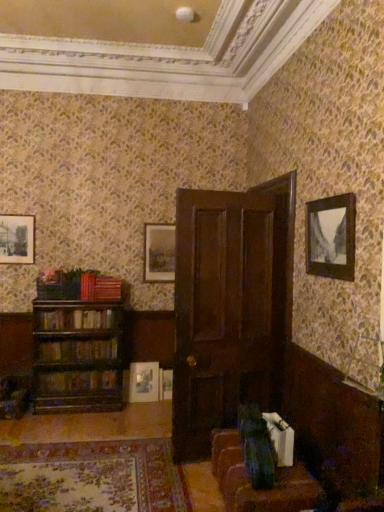
This screenshot has height=512, width=384. Find the location of `dark wood door at center`. dark wood door at center is located at coordinates (230, 307).

At what (x,y) coordinates should I click in order to perform the action: click on matte silver picture frame at center, the 3th picture frame positioned from the right. Please return your answer as a coordinate pair (x, y). Looking at the image, I should click on (144, 382).

From a real-world perspective, is wooden book at left, which is the fourth book from top to bottom, on matte wooden picture frame at center, the second picture frame positioned from the bottom?

Actually, wooden book at left, which is the fourth book from top to bottom, is physically below matte wooden picture frame at center, the second picture frame positioned from the bottom, in the real world.

The image size is (384, 512). Find the location of `book that is the 4th one when counting downward from the matte wooden picture frame at center, which is the first picture frame in back-to-front order (from the image's perspective)`. book that is the 4th one when counting downward from the matte wooden picture frame at center, which is the first picture frame in back-to-front order (from the image's perspective) is located at coordinates (77, 381).

Is point (118, 384) closer to viewer compared to point (165, 233)?

Yes, it is in front of point (165, 233).

Considering the relative sizes of wooden book at left, arranged as the 1th book when ordered from the bottom, and matte wooden picture frame at center, the second picture frame positioned from the bottom, in the image provided, is wooden book at left, arranged as the 1th book when ordered from the bottom, wider than matte wooden picture frame at center, the second picture frame positioned from the bottom,?

Correct, the width of wooden book at left, arranged as the 1th book when ordered from the bottom, exceeds that of matte wooden picture frame at center, the second picture frame positioned from the bottom.

What's the angular difference between matte wooden picture frame at center, which is the fourth picture frame from front to back, and dark wood door at center's facing directions?

There is a 167-degree angle between the facing directions of matte wooden picture frame at center, which is the fourth picture frame from front to back, and dark wood door at center.

Is dark wood door at center at the back of matte wooden picture frame at center, placed as the 2th picture frame when sorted from right to left?

That's not correct — matte wooden picture frame at center, placed as the 2th picture frame when sorted from right to left, is not looking away from dark wood door at center.

Considering the relative positions of matte wooden picture frame at center, the second picture frame positioned from the bottom, and dark wood door at center in the image provided, is matte wooden picture frame at center, the second picture frame positioned from the bottom, to the right of dark wood door at center from the viewer's perspective?

Incorrect, matte wooden picture frame at center, the second picture frame positioned from the bottom, is not on the right side of dark wood door at center.

Who is smaller, matte wooden picture frame at center, which is the first picture frame in back-to-front order, or dark wood door at center?

matte wooden picture frame at center, which is the first picture frame in back-to-front order.

In the scene shown: Does velvet green swivel chair at lower center have a smaller size compared to matte wooden picture frame at center, placed as the 2th picture frame when sorted from right to left?

No.

Could matte wooden picture frame at center, which is the fourth picture frame from front to back, be considered to be inside velvet green swivel chair at lower center?

No, matte wooden picture frame at center, which is the fourth picture frame from front to back, is not inside velvet green swivel chair at lower center.

Can you confirm if velvet green swivel chair at lower center is positioned to the right of matte wooden picture frame at center, the second picture frame positioned from the bottom?

Indeed, velvet green swivel chair at lower center is positioned on the right side of matte wooden picture frame at center, the second picture frame positioned from the bottom.

Considering the sizes of objects velvet green swivel chair at lower center and red matte book at left, marked as the fourth book in a bottom-to-top arrangement, in the image provided, who is thinner, velvet green swivel chair at lower center or red matte book at left, marked as the fourth book in a bottom-to-top arrangement,?

velvet green swivel chair at lower center is thinner.

In the image, is velvet green swivel chair at lower center positioned in front of or behind red matte book at left, the 1th book positioned from the top?

velvet green swivel chair at lower center is in front of red matte book at left, the 1th book positioned from the top.

You are a GUI agent. You are given a task and a screenshot of the screen. Output one action in this format:
    pyautogui.click(x=<x>, y=<y>)
    Task: Click on the swivel chair below the red matte book at left, marked as the fourth book in a bottom-to-top arrangement (from a real-world perspective)
    This screenshot has width=384, height=512.
    Given the screenshot: What is the action you would take?
    pyautogui.click(x=257, y=447)

I want to click on the 2nd picture frame behind the wooden picture frame at upper right, which is the first picture frame in right-to-left order, counting from the anchor's position, so click(x=144, y=382).

How much distance is there between matte silver picture frame at center, the 3th picture frame positioned from the right, and wooden picture frame at upper right, placed as the fourth picture frame when sorted from left to right?

matte silver picture frame at center, the 3th picture frame positioned from the right, is 2.66 meters from wooden picture frame at upper right, placed as the fourth picture frame when sorted from left to right.

Choose the correct answer: Is matte silver picture frame at center, which appears as the first picture frame when ordered from the bottom, inside wooden picture frame at upper right, the 4th picture frame when ordered from back to front, or outside it?

matte silver picture frame at center, which appears as the first picture frame when ordered from the bottom, cannot be found inside wooden picture frame at upper right, the 4th picture frame when ordered from back to front.

Looking at their sizes, would you say matte silver picture frame at center, which ranks as the fourth picture frame in top-to-bottom order, is wider or thinner than wooden picture frame at upper right, placed as the fourth picture frame when sorted from left to right?

In the image, matte silver picture frame at center, which ranks as the fourth picture frame in top-to-bottom order, appears to be wider than wooden picture frame at upper right, placed as the fourth picture frame when sorted from left to right.

Does velvet brown couch at lower right touch red matte book at left, marked as the fourth book in a bottom-to-top arrangement?

velvet brown couch at lower right and red matte book at left, marked as the fourth book in a bottom-to-top arrangement, are clearly separated.

Can you confirm if velvet brown couch at lower right is bigger than red matte book at left, the 1th book positioned from the top?

Yes.

Between point (245, 479) and point (109, 283), which one is positioned in front?

The point (245, 479) is closer.

Which is correct: velvet brown couch at lower right is inside red matte book at left, marked as the fourth book in a bottom-to-top arrangement, or outside of it?

velvet brown couch at lower right is outside red matte book at left, marked as the fourth book in a bottom-to-top arrangement.

How different are the orientations of matte silver picture frame at center, which ranks as the fourth picture frame in top-to-bottom order, and wooden bookshelf at left, positioned as the third book in bottom-to-top order, in degrees?

They differ by 0.583 degrees in their facing directions.

Is matte silver picture frame at center, which appears as the 2th picture frame when viewed from the left, facing towards wooden bookshelf at left, the 2th book viewed from the top?

No, matte silver picture frame at center, which appears as the 2th picture frame when viewed from the left, does not turn towards wooden bookshelf at left, the 2th book viewed from the top.

Is matte silver picture frame at center, positioned as the 3th picture frame in front-to-back order, wider than wooden bookshelf at left, the 2th book viewed from the top?

No.

Does point (148, 367) lie in front of point (110, 319)?

No, it is behind (110, 319).

From a real-world perspective, count 4th books downward from the matte wooden picture frame at center, the 3th picture frame in the left-to-right sequence, and point to it. Please provide its 2D coordinates.

[(77, 381)]

Locate an element on the screen. The image size is (384, 512). the 3rd picture frame behind the dark wood door at center is located at coordinates (159, 253).

When comparing their distances from velvet brown couch at lower right, does dark wood door at center or wooden bookshelf at left, the 2th book viewed from the top, seem further?

The object further to velvet brown couch at lower right is wooden bookshelf at left, the 2th book viewed from the top.

Estimate the real-world distances between objects in this image. Which object is further from red matte book at left, marked as the fourth book in a bottom-to-top arrangement, matte wooden picture frame at center, the 3th picture frame in the left-to-right sequence, or matte black picture frame at upper left, marked as the second picture frame in a front-to-back arrangement?

Based on the image, matte black picture frame at upper left, marked as the second picture frame in a front-to-back arrangement, appears to be further to red matte book at left, marked as the fourth book in a bottom-to-top arrangement.

When comparing their distances from velvet brown couch at lower right, does matte black picture frame at upper left, the fourth picture frame in the bottom-to-top sequence, or velvet green swivel chair at lower center seem further?

The object further to velvet brown couch at lower right is matte black picture frame at upper left, the fourth picture frame in the bottom-to-top sequence.

Looking at the image, which one is located closer to matte wooden picture frame at center, the second picture frame positioned from the bottom, wooden bookshelf at left, placed as the 3th book when sorted from top to bottom, or red matte book at left, the 1th book positioned from the top?

red matte book at left, the 1th book positioned from the top.

Which object lies further to the anchor point matte black picture frame at upper left, marked as the second picture frame in a front-to-back arrangement, wooden bookshelf at left, the 2th book viewed from the top, or velvet green swivel chair at lower center?

velvet green swivel chair at lower center lies further to matte black picture frame at upper left, marked as the second picture frame in a front-to-back arrangement, than the other object.

Looking at this image, based on their spatial positions, is matte wooden picture frame at center, placed as the 2th picture frame when sorted from right to left, or velvet brown couch at lower right further from wooden bookshelf at left, positioned as the third book in bottom-to-top order?

velvet brown couch at lower right lies further to wooden bookshelf at left, positioned as the third book in bottom-to-top order, than the other object.

Which object lies nearer to the anchor point velvet brown couch at lower right, wooden picture frame at upper right, which is the 1th picture frame from front to back, or matte black picture frame at upper left, arranged as the first picture frame when viewed from the top?

Among the two, wooden picture frame at upper right, which is the 1th picture frame from front to back, is located nearer to velvet brown couch at lower right.

Which object lies nearer to the anchor point velvet green swivel chair at lower center, matte wooden picture frame at center, the second picture frame positioned from the bottom, or red matte book at left, the 1th book positioned from the top?

red matte book at left, the 1th book positioned from the top, lies closer to velvet green swivel chair at lower center than the other object.

Image resolution: width=384 pixels, height=512 pixels. I want to click on picture frame positioned between velvet brown couch at lower right and wooden book at left, arranged as the 1th book when ordered from the bottom, from near to far, so click(331, 237).

Find the location of a particular element. swivel chair situated between matte black picture frame at upper left, the fourth picture frame in the bottom-to-top sequence, and velvet brown couch at lower right from left to right is located at coordinates (257, 447).

Find the location of a particular element. The height and width of the screenshot is (512, 384). door situated between matte black picture frame at upper left, the fourth picture frame in the bottom-to-top sequence, and velvet brown couch at lower right from left to right is located at coordinates (230, 307).

Identify the location of door between velvet green swivel chair at lower center and wooden book at left, which is the fourth book from top to bottom, along the z-axis. (230, 307).